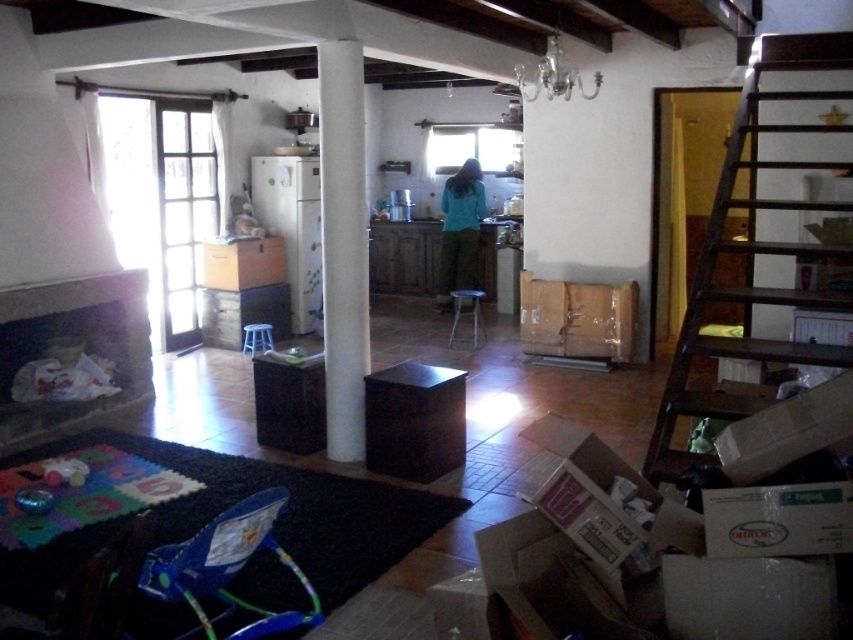
Based on the photo, you are organizing the living room and need to place a new sofa. The sofa will be placed where the brown cardboard box at center is currently located. Where should the sofa be placed relative to the matte black stool at center?

The brown cardboard box at center is to the right of the matte black stool at center, so the sofa should be placed to the right of the matte black stool at center.

You are a parent trying to move the blue plastic stool at center closer to the blue plastic walker at lower left. If you want the stool to be within 2 meters of the walker, how much distance do you need to move it?

The blue plastic walker at lower left is currently 3.89 meters away from the blue plastic stool at center. To bring the stool within 2 meters of the walker, you need to move it approximately 1.89 meters closer.

You are a parent trying to move the blue plastic walker at lower left to the other side of the black matte cabinet at center. Can you do this without moving the cabinet?

The blue plastic walker at lower left is positioned on the left side of the black matte cabinet at center, so you can move it to the other side of the cabinet without moving the cabinet itself.